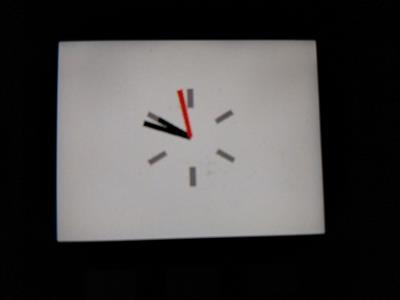
Find the location of a particular element. The height and width of the screenshot is (300, 400). upper right corner of clock is located at coordinates (315, 42).